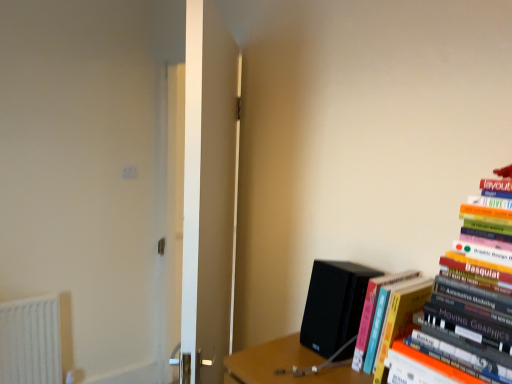
The image size is (512, 384). What do you see at coordinates (208, 194) in the screenshot?
I see `white glossy door at center` at bounding box center [208, 194].

In order to face black matte speaker at lower right, should I rotate leftwards or rightwards?

Turn right by 12.101 degrees to look at black matte speaker at lower right.

Measure the distance between point (462, 217) and camera.

The distance of point (462, 217) from camera is 38.39 inches.

You are a GUI agent. You are given a task and a screenshot of the screen. Output one action in this format:
    pyautogui.click(x=<x>, y=<y>)
    Task: Click on the white glossy door at center
    This screenshot has height=384, width=512.
    Given the screenshot: What is the action you would take?
    pyautogui.click(x=208, y=194)

Consider the image. Can you see white glossy door at center touching hardcover books at right, positioned as the second book in back-to-front order?

No, white glossy door at center is not in contact with hardcover books at right, positioned as the second book in back-to-front order.

Image resolution: width=512 pixels, height=384 pixels. What are the coordinates of `door below the hardcover books at right, positioned as the second book in back-to-front order (from a real-world perspective)` in the screenshot? It's located at (208, 194).

Does white glossy door at center have a greater width compared to hardcover books at right, placed as the first book when sorted from front to back?

No.

How many degrees apart are the facing directions of white glossy door at center and hardcover books at right, placed as the first book when sorted from front to back?

They differ by 43.8 degrees in their facing directions.

Does point (350, 299) lie in front of point (501, 232)?

No, it is not.

Would you consider black matte speaker at lower right to be distant from hardcover books at right, placed as the first book when sorted from front to back?

No.

Does black matte speaker at lower right turn towards hardcover books at right, positioned as the second book in back-to-front order?

No, black matte speaker at lower right is not turned towards hardcover books at right, positioned as the second book in back-to-front order.

How distant is black matte speaker at lower right from hardcover books at right, positioned as the second book in back-to-front order?

A distance of 8.77 inches exists between black matte speaker at lower right and hardcover books at right, positioned as the second book in back-to-front order.

Does point (401, 278) come in front of point (324, 348)?

Yes, point (401, 278) is closer to viewer.

Are orange matte book at right, which appears as the first book when viewed from the back, and black matte speaker at lower right far apart?

orange matte book at right, which appears as the first book when viewed from the back, is actually quite close to black matte speaker at lower right.

Is orange matte book at right, which is the second book from front to back, aimed at black matte speaker at lower right?

No.

Is orange matte book at right, which is the second book from front to back, wider than black matte speaker at lower right?

Yes, orange matte book at right, which is the second book from front to back, is wider than black matte speaker at lower right.

From a real-world perspective, who is located lower, white glossy door at center or orange matte book at right, which appears as the first book when viewed from the back?

In real-world perspective, orange matte book at right, which appears as the first book when viewed from the back, is lower.

From the image's perspective, is white glossy door at center located above orange matte book at right, which is the second book from front to back?

Yes, from the image's perspective, white glossy door at center is on top of orange matte book at right, which is the second book from front to back.

What are the coordinates of `book directly beneath the white glossy door at center (from a real-world perspective)` in the screenshot? It's located at (375, 308).

From the image's perspective, between hardcover books at right, positioned as the second book in back-to-front order, and orange matte book at right, which appears as the first book when viewed from the back, who is located below?

orange matte book at right, which appears as the first book when viewed from the back, appears lower in the image.

Can you tell me how much hardcover books at right, positioned as the second book in back-to-front order, and orange matte book at right, which appears as the first book when viewed from the back, differ in facing direction?

There is a 0.159-degree angle between the facing directions of hardcover books at right, positioned as the second book in back-to-front order, and orange matte book at right, which appears as the first book when viewed from the back.

Locate an element on the screen. The image size is (512, 384). book to the right of orange matte book at right, which is the second book from front to back is located at coordinates (462, 313).

Between hardcover books at right, placed as the first book when sorted from front to back, and orange matte book at right, which appears as the first book when viewed from the back, which one has larger width?

hardcover books at right, placed as the first book when sorted from front to back, is wider.

Would you say black matte speaker at lower right is outside white glossy door at center?

Yes, black matte speaker at lower right is located beyond the bounds of white glossy door at center.

Considering the positions of objects black matte speaker at lower right and white glossy door at center in the image provided, who is more to the left, black matte speaker at lower right or white glossy door at center?

white glossy door at center.

Looking at their sizes, would you say black matte speaker at lower right is wider or thinner than white glossy door at center?

In the image, black matte speaker at lower right appears to be wider than white glossy door at center.

From the image's perspective, is orange matte book at right, which appears as the first book when viewed from the back, above or below white glossy door at center?

orange matte book at right, which appears as the first book when viewed from the back, is situated lower than white glossy door at center in the image.

Is orange matte book at right, which is the second book from front to back, thinner than white glossy door at center?

No, orange matte book at right, which is the second book from front to back, is not thinner than white glossy door at center.

Does point (358, 351) lie behind point (236, 73)?

No, (358, 351) is closer to viewer.

The height and width of the screenshot is (384, 512). I want to click on door that appears above the orange matte book at right, which appears as the first book when viewed from the back (from a real-world perspective), so click(208, 194).

Where is `the 2nd book in front of the white glossy door at center`? The image size is (512, 384). the 2nd book in front of the white glossy door at center is located at coordinates (462, 313).

Locate an element on the screen. The width and height of the screenshot is (512, 384). paperback book that is under the hardcover books at right, placed as the first book when sorted from front to back (from a real-world perspective) is located at coordinates (334, 304).

When comparing their distances from hardcover books at right, placed as the first book when sorted from front to back, does orange matte book at right, which is the second book from front to back, or white glossy door at center seem further?

white glossy door at center lies further to hardcover books at right, placed as the first book when sorted from front to back, than the other object.

From the image, which object appears to be nearer to orange matte book at right, which appears as the first book when viewed from the back, white glossy door at center or black matte speaker at lower right?

The object closer to orange matte book at right, which appears as the first book when viewed from the back, is black matte speaker at lower right.

Which object lies further to the anchor point hardcover books at right, placed as the first book when sorted from front to back, white glossy door at center or orange matte book at right, which appears as the first book when viewed from the back?

Based on the image, white glossy door at center appears to be further to hardcover books at right, placed as the first book when sorted from front to back.

From the image, which object appears to be farther from white glossy door at center, black matte speaker at lower right or orange matte book at right, which is the second book from front to back?

Based on the image, orange matte book at right, which is the second book from front to back, appears to be further to white glossy door at center.

Estimate the real-world distances between objects in this image. Which object is closer to orange matte book at right, which appears as the first book when viewed from the back, black matte speaker at lower right or white glossy door at center?

The object closer to orange matte book at right, which appears as the first book when viewed from the back, is black matte speaker at lower right.

Looking at the image, which one is located closer to white glossy door at center, black matte speaker at lower right or hardcover books at right, positioned as the second book in back-to-front order?

Among the two, black matte speaker at lower right is located nearer to white glossy door at center.

Looking at the image, which one is located closer to white glossy door at center, orange matte book at right, which is the second book from front to back, or black matte speaker at lower right?

black matte speaker at lower right lies closer to white glossy door at center than the other object.

Estimate the real-world distances between objects in this image. Which object is closer to orange matte book at right, which is the second book from front to back, hardcover books at right, positioned as the second book in back-to-front order, or black matte speaker at lower right?

black matte speaker at lower right is positioned closer to the anchor orange matte book at right, which is the second book from front to back.

Image resolution: width=512 pixels, height=384 pixels. Find the location of `book located between hardcover books at right, positioned as the second book in back-to-front order, and black matte speaker at lower right in the depth direction`. book located between hardcover books at right, positioned as the second book in back-to-front order, and black matte speaker at lower right in the depth direction is located at coordinates (375, 308).

Find the location of a particular element. The image size is (512, 384). book situated between white glossy door at center and hardcover books at right, placed as the first book when sorted from front to back, from left to right is located at coordinates coord(375,308).

What are the coordinates of `paperback book between white glossy door at center and hardcover books at right, placed as the first book when sorted from front to back, from left to right` in the screenshot? It's located at (334, 304).

Locate an element on the screen. Image resolution: width=512 pixels, height=384 pixels. paperback book between white glossy door at center and orange matte book at right, which is the second book from front to back is located at coordinates (334, 304).